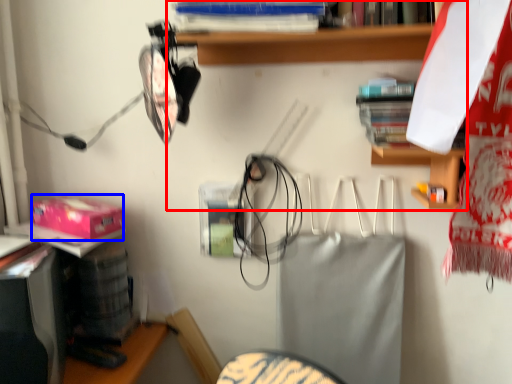
Question: Which object is closer to the camera taking this photo, shelf (highlighted by a red box) or box (highlighted by a blue box)?

Choices:
 (A) shelf
 (B) box

Answer: (A)